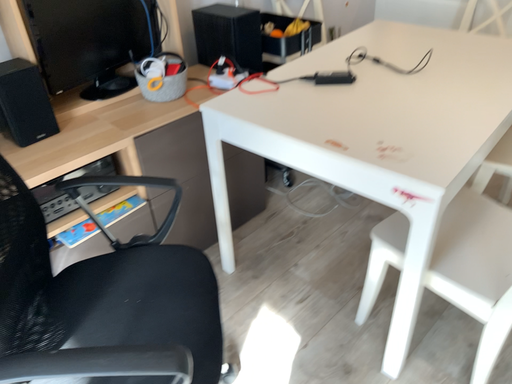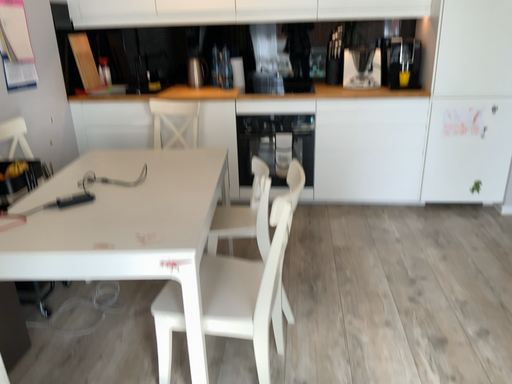
Question: How did the camera likely rotate when shooting the video?

Choices:
 (A) rotated downward
 (B) rotated upward

Answer: (B)